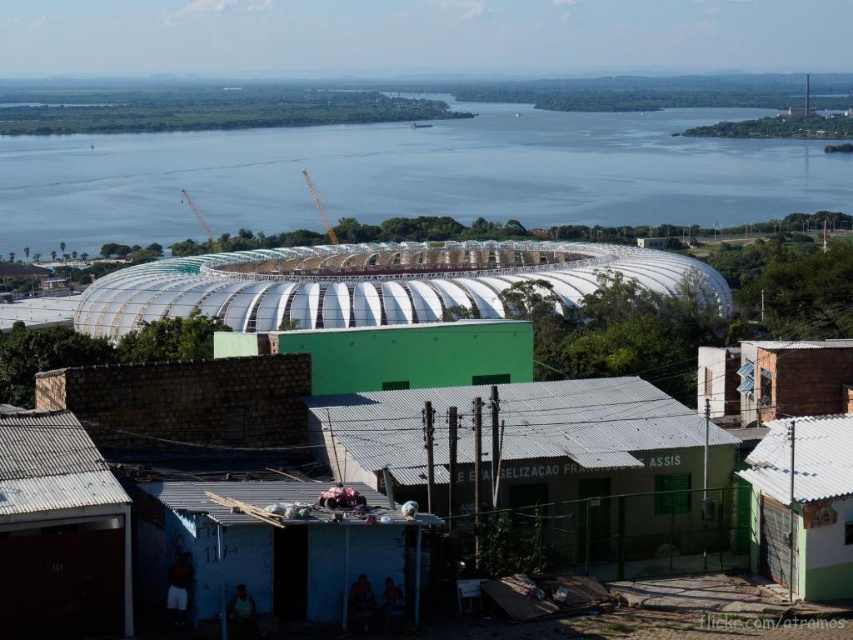
Question: Does white translucent dome at center appear on the left side of blue water at center?

Choices:
 (A) yes
 (B) no

Answer: (B)

Question: Does white translucent dome at center appear on the left side of blue water at center?

Choices:
 (A) yes
 (B) no

Answer: (B)

Question: Can you confirm if white translucent dome at center is thinner than blue water at center?

Choices:
 (A) yes
 (B) no

Answer: (A)

Question: Which object appears farthest from the camera in this image?

Choices:
 (A) white translucent dome at center
 (B) blue water at center

Answer: (B)